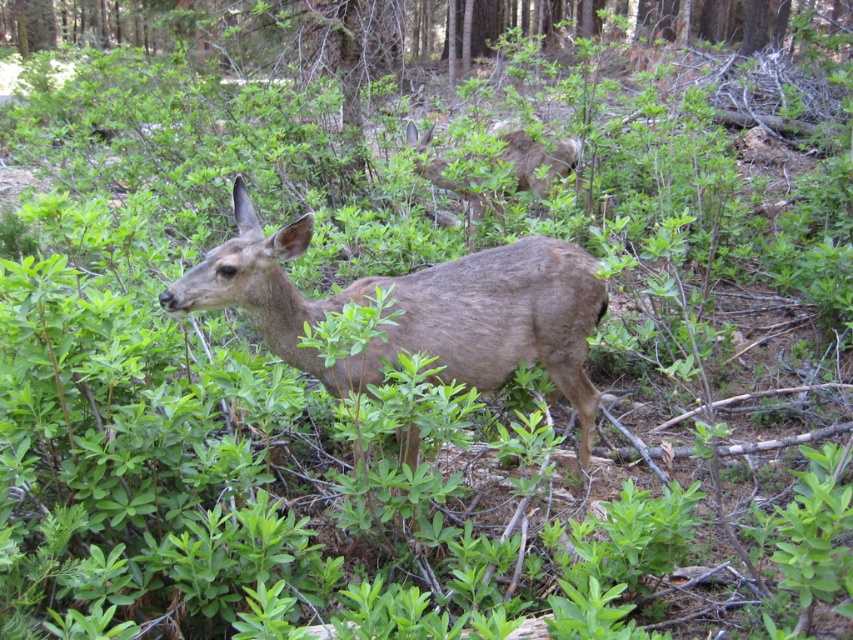
Question: Which point is farther from the camera taking this photo?

Choices:
 (A) (378, 380)
 (B) (505, 150)

Answer: (B)

Question: Which object is farther from the camera taking this photo?

Choices:
 (A) brown furry deer at upper center
 (B) brown fur deer at center

Answer: (A)

Question: Is brown fur deer at center above brown furry deer at upper center?

Choices:
 (A) no
 (B) yes

Answer: (A)

Question: Which point is farther to the camera?

Choices:
 (A) brown fur deer at center
 (B) brown furry deer at upper center

Answer: (B)

Question: Does brown fur deer at center appear over brown furry deer at upper center?

Choices:
 (A) yes
 (B) no

Answer: (B)

Question: Does brown fur deer at center appear on the right side of brown furry deer at upper center?

Choices:
 (A) yes
 (B) no

Answer: (B)